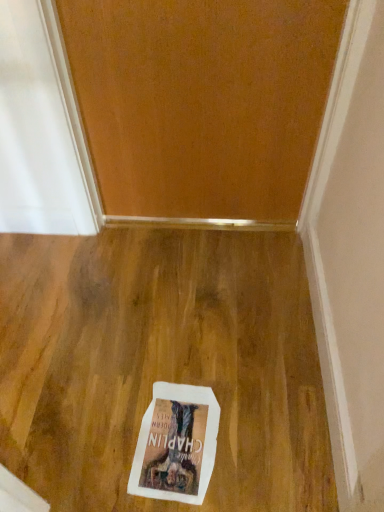
Locate an element on the screen. free space to the left of white paper postcard at center is located at coordinates (87, 430).